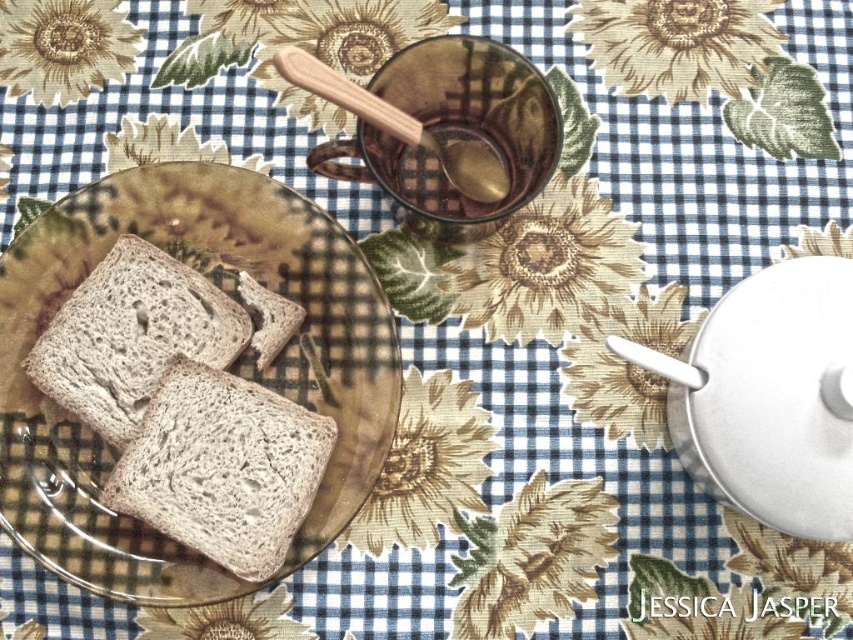
Question: Considering the real-world distances, which object is farthest from the brown textured bread at center?

Choices:
 (A) brown matte bread at center
 (B) brown matte bread at left
 (C) wooden spoon at upper center

Answer: (C)

Question: Is brown textured bread at center thinner than brown matte bread at left?

Choices:
 (A) yes
 (B) no

Answer: (A)

Question: Which of the following is the farthest from the observer?

Choices:
 (A) (299, 262)
 (B) (271, 314)
 (C) (242, 525)
 (D) (497, 177)

Answer: (D)

Question: Can you confirm if brown textured bread at center is positioned to the right of brown matte bread at left?

Choices:
 (A) yes
 (B) no

Answer: (A)

Question: Considering the relative positions of brown matte plate at center-left and brown matte bread at left in the image provided, where is brown matte plate at center-left located with respect to brown matte bread at left?

Choices:
 (A) right
 (B) left

Answer: (A)

Question: Which point appears farthest from the camera in this image?

Choices:
 (A) (384, 100)
 (B) (265, 554)
 (C) (265, 358)
 (D) (120, 429)

Answer: (C)